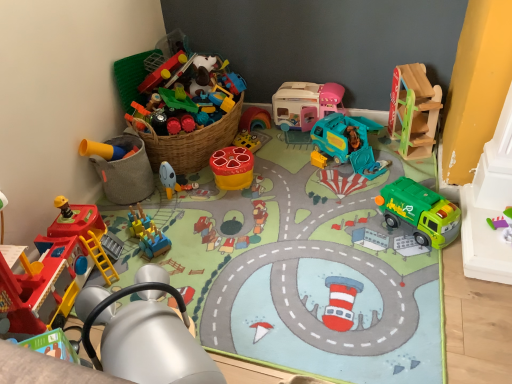
This screenshot has width=512, height=384. In order to click on vacant area that is in front of matte plastic toy at center, which is the 3th toy in left-to-right order in this screenshot , I will do `click(185, 215)`.